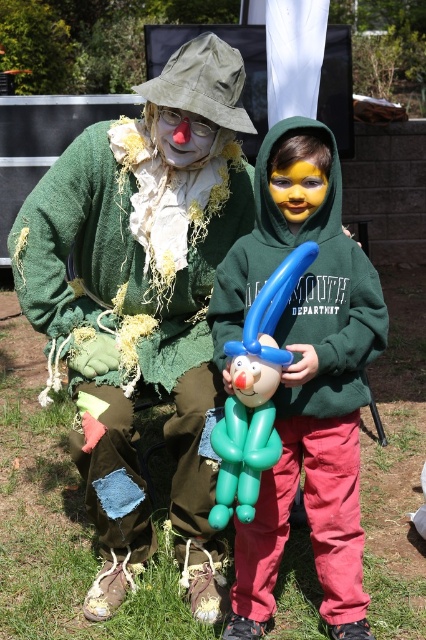
You are a photographer setting up for a group photo. You have two props available, the matte green hoodie at center and the green rubber balloon animal at center. Which prop should you choose if you want something that can be seen clearly from the back row of the audience?

The matte green hoodie at center has a greater height compared to the green rubber balloon animal at center, so it will be more visible from the back row.

You are at a costume party and see two items at the center of the scene. The ripped green sweater at center and the green rubber balloon animal at center. Which one is positioned to the right?

The green rubber balloon animal at center is positioned to the right of the ripped green sweater at center.